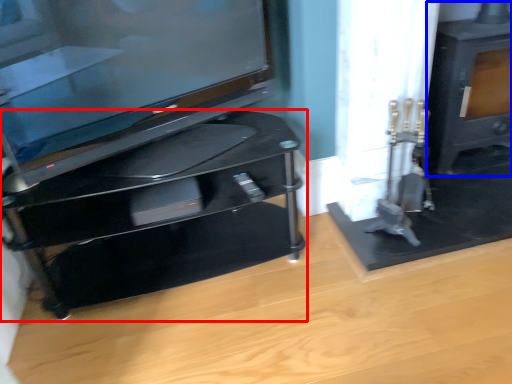
Question: Which object appears farthest to the camera in this image, furniture (highlighted by a red box) or stove (highlighted by a blue box)?

Choices:
 (A) furniture
 (B) stove

Answer: (B)